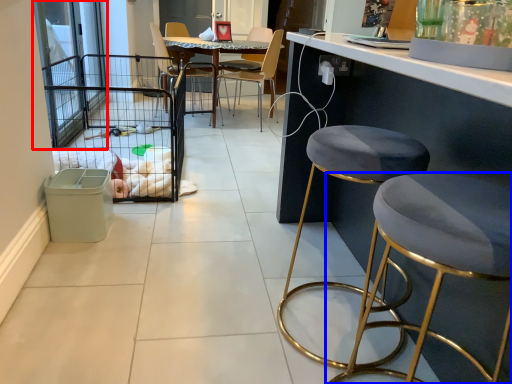
Question: Which of the following is the closest to the observer, screen door (highlighted by a red box) or stool (highlighted by a blue box)?

Choices:
 (A) screen door
 (B) stool

Answer: (B)